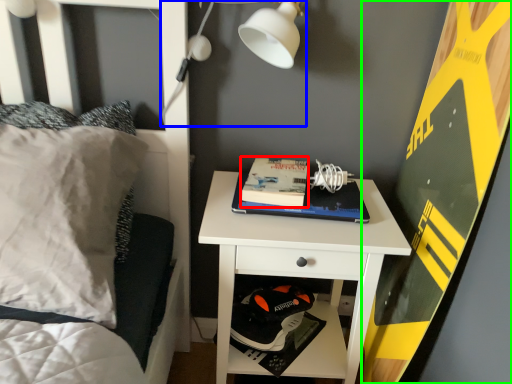
Question: Estimate the real-world distances between objects in this image. Which object is closer to paperback book (highlighted by a red box), light fixture (highlighted by a blue box) or bulletin board (highlighted by a green box)?

Choices:
 (A) light fixture
 (B) bulletin board

Answer: (A)